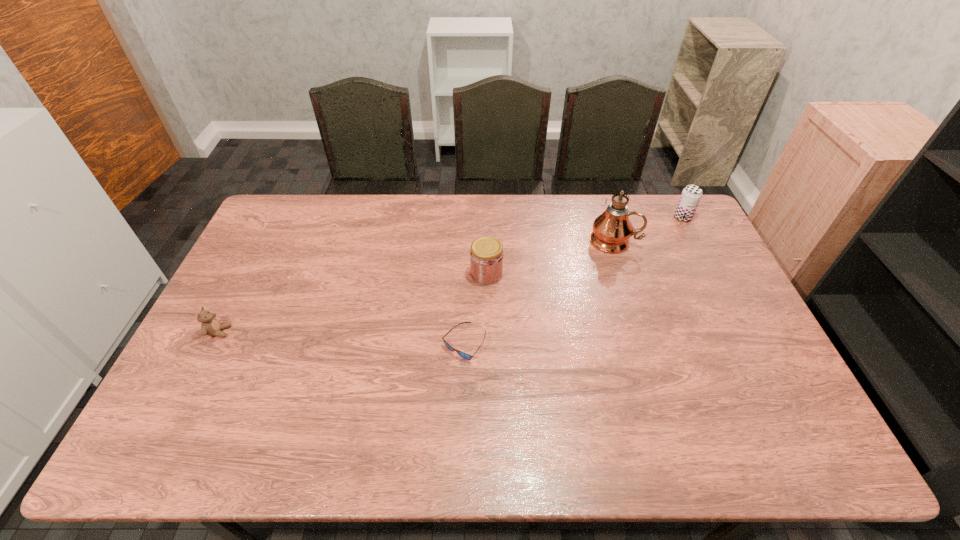
I want to click on vacant region between the tallest object and the shortest object, so click(x=540, y=292).

This screenshot has height=540, width=960. What are the coordinates of `blank region between the jam and the second farthest object` in the screenshot? It's located at (550, 257).

Where is `free space between the shortest object and the teddy bear`? This screenshot has width=960, height=540. free space between the shortest object and the teddy bear is located at coordinates (342, 338).

This screenshot has height=540, width=960. What are the coordinates of `object that is the closest one to the beer can` in the screenshot? It's located at (612, 229).

Select which object is the fourth closest to the jam. Please provide its 2D coordinates. Your answer should be formatted as a tuple, i.e. [(x, y)], where the tuple contains the x and y coordinates of a point satisfying the conditions above.

[(210, 326)]

The width and height of the screenshot is (960, 540). Identify the location of free space that satisfies the following two spatial constraints: 1. on the front side of the fourth nearest object; 2. on the front-facing side of the teddy bear. (643, 332).